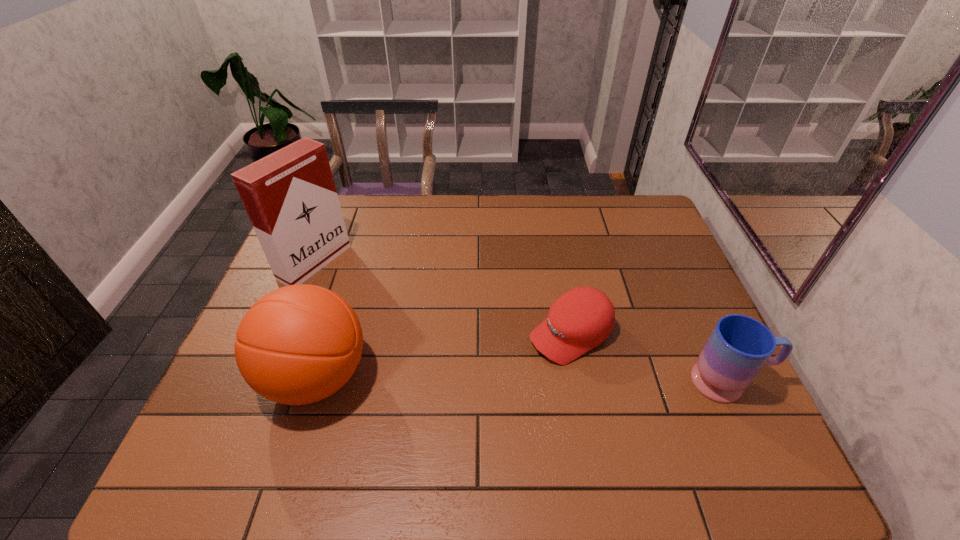
The height and width of the screenshot is (540, 960). I want to click on empty space that is in between the tallest object and the mug, so click(x=521, y=322).

Image resolution: width=960 pixels, height=540 pixels. Find the location of `vacant point located between the rightmost object and the cap`. vacant point located between the rightmost object and the cap is located at coordinates (650, 358).

At what (x,y) coordinates should I click in order to perform the action: click on vacant space in between the third tallest object and the basketball. Please return your answer as a coordinate pair (x, y). The width and height of the screenshot is (960, 540). Looking at the image, I should click on (522, 379).

Image resolution: width=960 pixels, height=540 pixels. I want to click on object that can be found as the third closest to the second tallest object, so click(739, 346).

Find the location of a particular element. the second closest object to the second tallest object is located at coordinates (582, 318).

This screenshot has height=540, width=960. What are the coordinates of `free space that satisfies the following two spatial constraints: 1. on the back side of the second tallest object; 2. on the left side of the second object from right to left` in the screenshot? It's located at [330, 334].

Where is `free space that satisfies the following two spatial constraints: 1. on the front side of the shortest object; 2. on the left side of the farthest object`? This screenshot has width=960, height=540. free space that satisfies the following two spatial constraints: 1. on the front side of the shortest object; 2. on the left side of the farthest object is located at coordinates (286, 334).